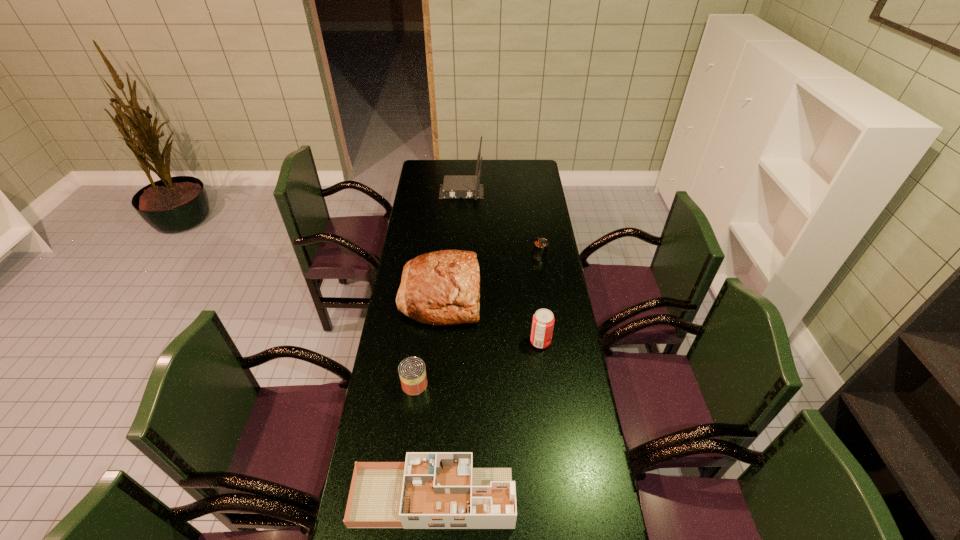
Identify the location of router. (468, 187).

The image size is (960, 540). Identify the location of the farthest object. (468, 187).

This screenshot has height=540, width=960. I want to click on bread, so click(x=443, y=287).

Find the location of a particular element. The width and height of the screenshot is (960, 540). the fourth nearest object is located at coordinates (443, 287).

Locate an element on the screen. The width and height of the screenshot is (960, 540). the fourth farthest object is located at coordinates (543, 320).

You are a GUI agent. You are given a task and a screenshot of the screen. Output one action in this format:
    pyautogui.click(x=<x>, y=<y>)
    Task: Click on the fourth shortest object
    The width and height of the screenshot is (960, 540).
    Given the screenshot: What is the action you would take?
    pyautogui.click(x=543, y=320)

At what (x,y) coordinates should I click in order to perform the action: click on the second farthest object. Please return your answer as a coordinate pair (x, y). Image resolution: width=960 pixels, height=540 pixels. Looking at the image, I should click on (540, 249).

Image resolution: width=960 pixels, height=540 pixels. Find the location of `the farther can`. the farther can is located at coordinates (540, 249).

You are a GUI agent. You are given a task and a screenshot of the screen. Output one action in this format:
    pyautogui.click(x=<x>, y=<y>)
    Task: Click on the dollhouse
    This screenshot has width=960, height=540.
    Given the screenshot: What is the action you would take?
    coord(431,490)

Locate an element on the screen. the left can is located at coordinates (412, 372).